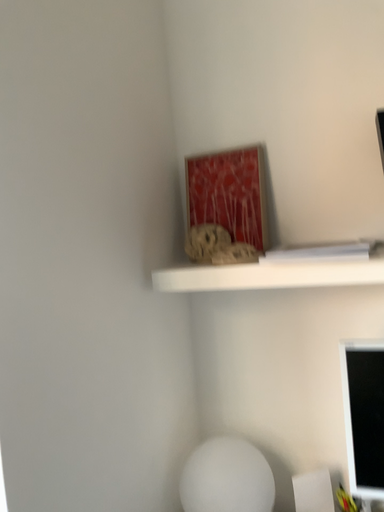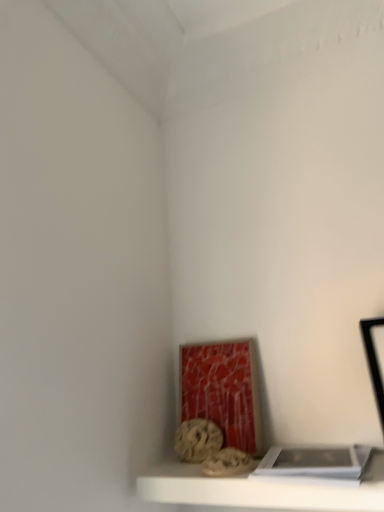
Question: How did the camera likely rotate when shooting the video?

Choices:
 (A) rotated downward
 (B) rotated upward

Answer: (B)